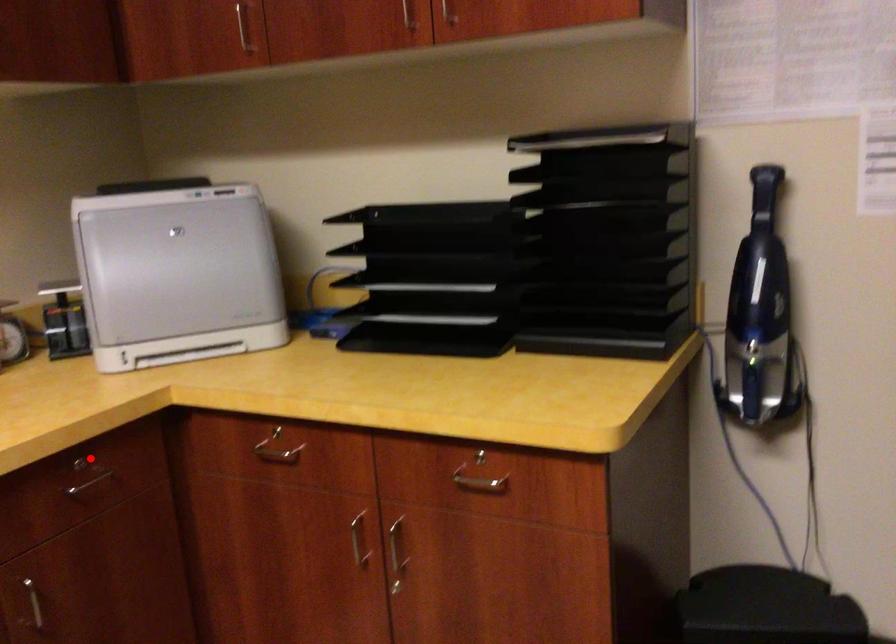
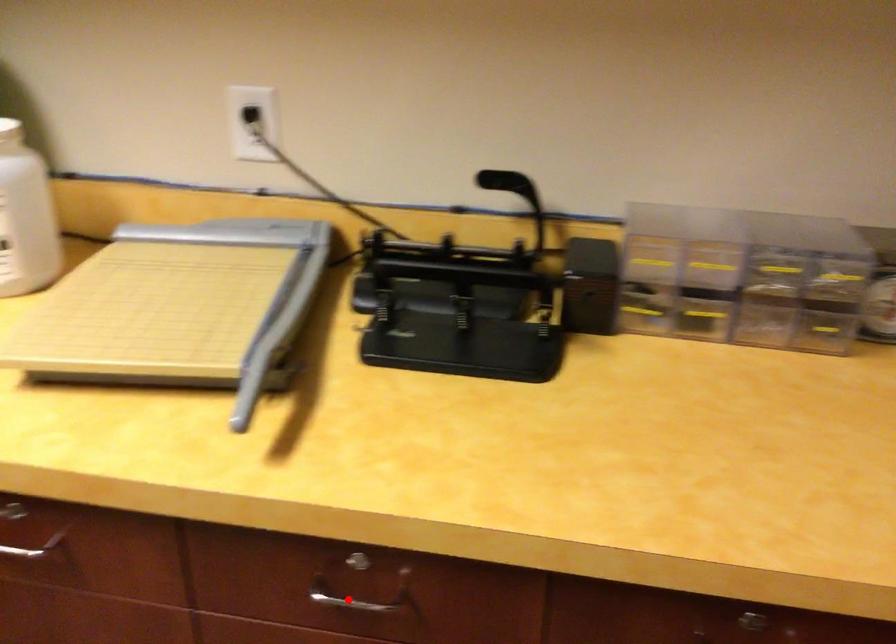
I am providing you with two images of the same scene from different viewpoints. A red point is marked on the first image and another point is marked on the second image. Is the red point in image1 aligned with the point shown in image2?

No